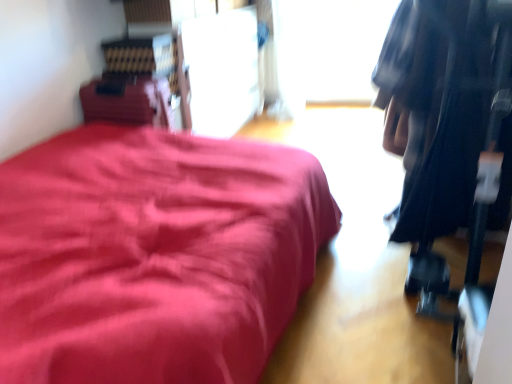
Question: Can you confirm if black fabric bag at right is positioned to the left of matte red bed at left?

Choices:
 (A) yes
 (B) no

Answer: (B)

Question: Considering the relative sizes of black fabric bag at right and matte red bed at left in the image provided, is black fabric bag at right thinner than matte red bed at left?

Choices:
 (A) no
 (B) yes

Answer: (B)

Question: From a real-world perspective, is black fabric bag at right below matte red bed at left?

Choices:
 (A) no
 (B) yes

Answer: (A)

Question: Is black fabric bag at right in contact with matte red bed at left?

Choices:
 (A) no
 (B) yes

Answer: (A)

Question: Is black fabric bag at right closer to camera compared to matte red bed at left?

Choices:
 (A) no
 (B) yes

Answer: (A)

Question: Is black fabric bag at right bigger than matte red bed at left?

Choices:
 (A) yes
 (B) no

Answer: (A)

Question: From a real-world perspective, is black fabric bag at right located higher than transparent glass window at upper center?

Choices:
 (A) no
 (B) yes

Answer: (B)

Question: Is the position of black fabric bag at right more distant than that of transparent glass window at upper center?

Choices:
 (A) yes
 (B) no

Answer: (B)

Question: From the image's perspective, is black fabric bag at right located beneath transparent glass window at upper center?

Choices:
 (A) no
 (B) yes

Answer: (B)

Question: Does black fabric bag at right turn towards transparent glass window at upper center?

Choices:
 (A) yes
 (B) no

Answer: (B)

Question: Does black fabric bag at right have a greater width compared to transparent glass window at upper center?

Choices:
 (A) no
 (B) yes

Answer: (B)

Question: Considering the relative positions of black fabric bag at right and transparent glass window at upper center in the image provided, is black fabric bag at right to the right of transparent glass window at upper center from the viewer's perspective?

Choices:
 (A) yes
 (B) no

Answer: (A)

Question: Is matte red bed at left wider than transparent glass window at upper center?

Choices:
 (A) yes
 (B) no

Answer: (A)